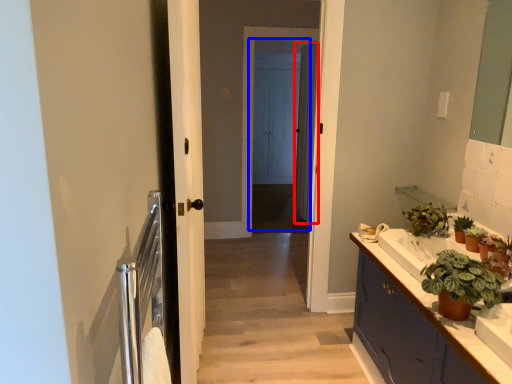
Question: Which object is closer to the camera taking this photo, curtain (highlighted by a red box) or screen door (highlighted by a blue box)?

Choices:
 (A) curtain
 (B) screen door

Answer: (B)